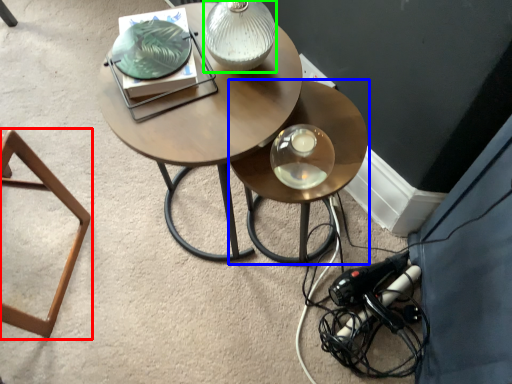
Question: Based on their relative distances, which object is farther from stool (highlighted by a red box)? Choose from table (highlighted by a blue box) and table lamp (highlighted by a green box).

Choices:
 (A) table
 (B) table lamp

Answer: (A)